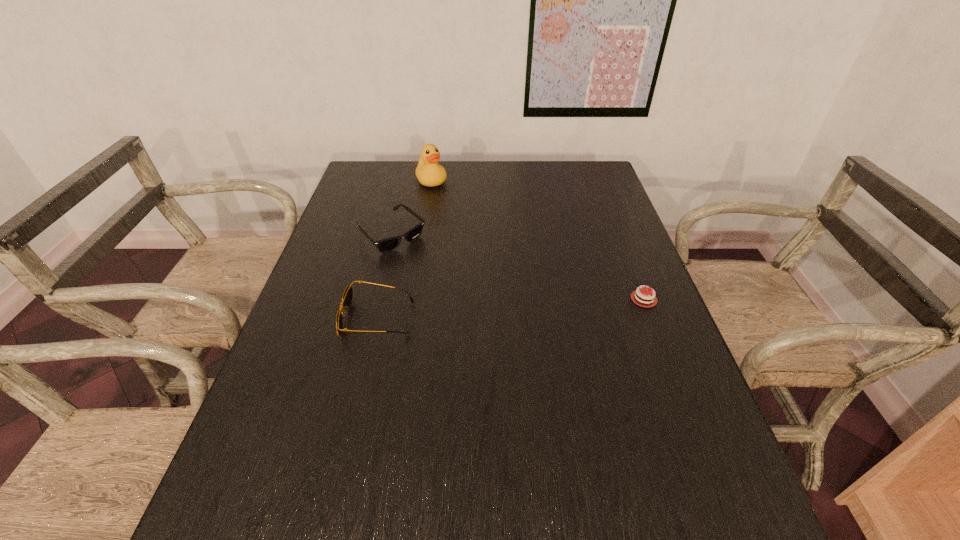
Image resolution: width=960 pixels, height=540 pixels. I want to click on vacant space on the desktop that is between the nearer sunglasses and the rightmost object and is positioned at the beak of the tallest object, so click(x=531, y=307).

Locate an element on the screen. The image size is (960, 540). free space on the desktop that is between the nearer sunglasses and the chocolate cake and is positioned on the front-facing side of the farther sunglasses is located at coordinates (475, 312).